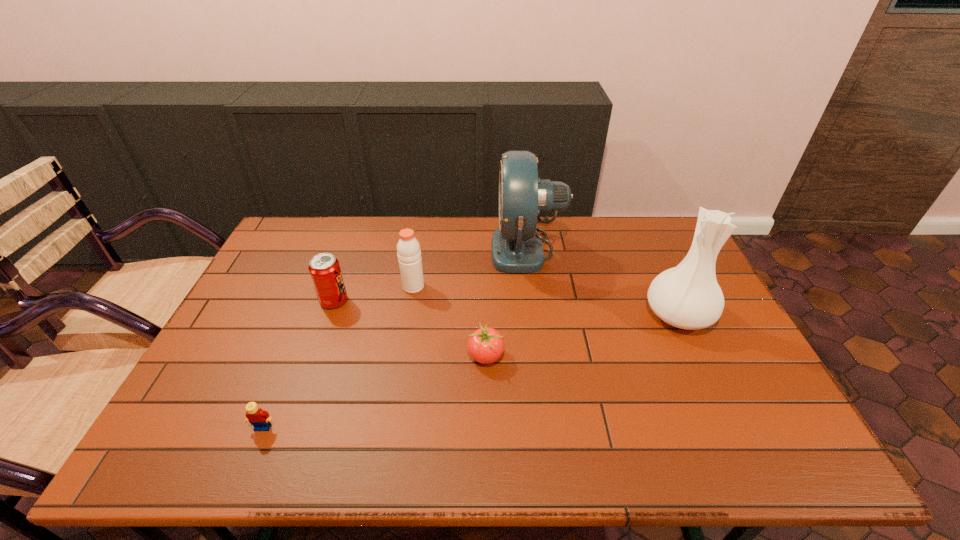
In the image, there is a desktop. Where is `vacant space at the right edge`? vacant space at the right edge is located at coordinates (737, 424).

Where is `free location at the far right corner`? free location at the far right corner is located at coordinates (679, 248).

This screenshot has width=960, height=540. In order to click on vacant space at the near right corner of the desktop in this screenshot , I will do `click(781, 444)`.

At what (x,y) coordinates should I click in order to perform the action: click on free space between the fourth object from right to left and the soda can. Please return your answer as a coordinate pair (x, y). Looking at the image, I should click on point(373,294).

Locate an element on the screen. This screenshot has width=960, height=540. free area in between the nearest object and the rightmost object is located at coordinates (470, 371).

I want to click on free space that is in between the nearest object and the vase, so click(x=470, y=371).

In order to click on vacant region between the soda can and the vase in this screenshot , I will do `click(506, 308)`.

I want to click on vacant space in between the second nearest object and the shaker, so [x=449, y=321].

At what (x,y) coordinates should I click in order to perform the action: click on vacant point located between the fan and the Lego. Please return your answer as a coordinate pair (x, y). The height and width of the screenshot is (540, 960). Looking at the image, I should click on (396, 338).

Find the location of a particular element. The width and height of the screenshot is (960, 540). empty space between the fan and the tomato is located at coordinates [x=507, y=302].